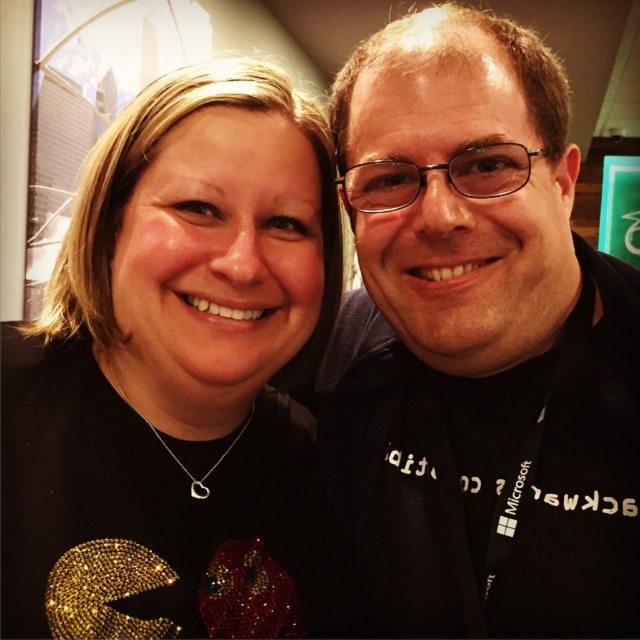
Question: Does black matte shirt at center appear on the right side of black matte pac-man at center?

Choices:
 (A) yes
 (B) no

Answer: (A)

Question: Is black matte shirt at center bigger than black matte pac-man at center?

Choices:
 (A) no
 (B) yes

Answer: (B)

Question: Which of the following is the farthest from the observer?

Choices:
 (A) (566, 397)
 (B) (172, 314)

Answer: (A)

Question: Which point is closer to the camera taking this photo?

Choices:
 (A) (12, 632)
 (B) (444, 198)

Answer: (B)

Question: Which point is farther from the camera taking this photo?

Choices:
 (A) (259, 406)
 (B) (404, 632)

Answer: (A)

Question: Is black matte shirt at center to the left of black matte pac-man at center from the viewer's perspective?

Choices:
 (A) no
 (B) yes

Answer: (A)